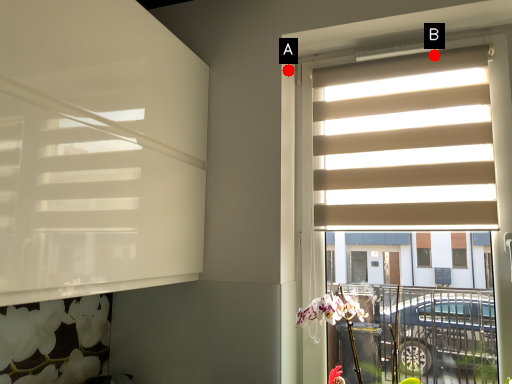
Question: Two points are circled on the image, labeled by A and B beside each circle. Which point is closer to the camera?

Choices:
 (A) A is closer
 (B) B is closer

Answer: (B)